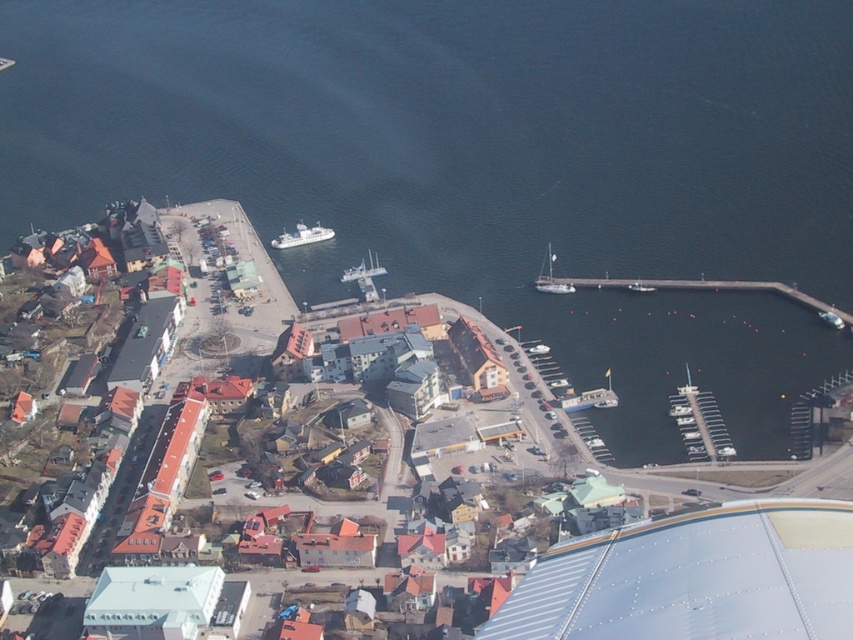
You are a photographer planning to capture the waterfront scene. You have a camera with a limited zoom range that can only focus on objects up to 100 meters away. Given that the white matte ship at center is closer to the photographer than the white plastic boat at center, can you confirm if both vessels will be in focus?

The white matte ship at center is closer to the photographer than the white plastic boat at center. Since the camera can focus up to 100 meters, both vessels will be within range as long as the closest ship is within 100 meters. However, the exact distances aren not provided, so we can only confirm that the white matte ship at center is closer and thus within range if the farther boat is also within 100 meters.